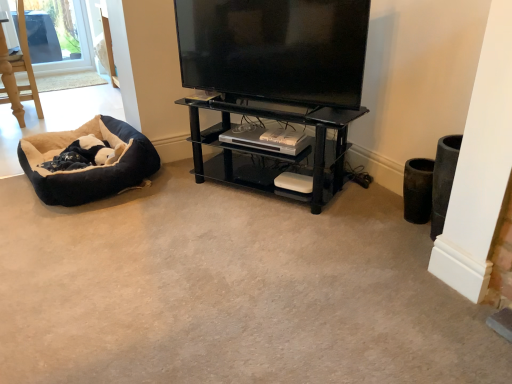
This screenshot has width=512, height=384. What do you see at coordinates (272, 147) in the screenshot?
I see `black glass shelf at center` at bounding box center [272, 147].

Where is `black glossy flat-screen tv at upper center`? Image resolution: width=512 pixels, height=384 pixels. black glossy flat-screen tv at upper center is located at coordinates (275, 48).

From a real-world perspective, which object rests below the other?

black plush dog bed at lower left.

Which point is more forward, (x=104, y=147) or (x=211, y=10)?

Point (x=211, y=10)

Which of these two, black plush dog bed at lower left or black glossy flat-screen tv at upper center, is thinner?

black glossy flat-screen tv at upper center.

From the picture: Considering the relative sizes of soft plush dog bed at left and black glossy flat-screen tv at upper center in the image provided, is soft plush dog bed at left smaller than black glossy flat-screen tv at upper center?

No.

From the image's perspective, is soft plush dog bed at left located above or below black glossy flat-screen tv at upper center?

Based on their image positions, soft plush dog bed at left is located beneath black glossy flat-screen tv at upper center.

Is black glass shelf at center far from soft plush dog bed at left?

They are positioned close to each other.

Is point (226, 114) closer or farther from the camera than point (113, 132)?

Point (226, 114) is closer to the camera than point (113, 132).

How many degrees apart are the facing directions of black glass shelf at center and soft plush dog bed at left?

23.1 degrees separate the facing orientations of black glass shelf at center and soft plush dog bed at left.

Which of these two, black glass shelf at center or soft plush dog bed at left, is smaller?

soft plush dog bed at left is smaller.

Does soft plush dog bed at left appear on the right side of black plush dog bed at lower left?

Indeed, soft plush dog bed at left is positioned on the right side of black plush dog bed at lower left.

Is black plush dog bed at lower left surrounded by soft plush dog bed at left?

Yes, black plush dog bed at lower left is surrounded by soft plush dog bed at left.

From the image's perspective, which one is positioned higher, black glossy flat-screen tv at upper center or black glass shelf at center?

black glossy flat-screen tv at upper center is shown above in the image.

Is point (344, 16) closer or farther from the camera than point (268, 102)?

Point (344, 16).

Is black glossy flat-screen tv at upper center bigger or smaller than black glass shelf at center?

In the image, black glossy flat-screen tv at upper center appears to be smaller than black glass shelf at center.

Can you tell me how much black glossy flat-screen tv at upper center and black glass shelf at center differ in facing direction?

black glossy flat-screen tv at upper center and black glass shelf at center are facing 0.000222 degrees away from each other.

Does black plush dog bed at lower left have a greater height compared to black glass shelf at center?

No, black plush dog bed at lower left is not taller than black glass shelf at center.

Could you tell me if black plush dog bed at lower left is turned towards black glass shelf at center?

No, black plush dog bed at lower left is not aimed at black glass shelf at center.

Which object is further away from the camera taking this photo, black plush dog bed at lower left or black glass shelf at center?

black plush dog bed at lower left is more distant.

How much distance is there between black plush dog bed at lower left and black glass shelf at center?

black plush dog bed at lower left is 30.25 inches away from black glass shelf at center.

Image resolution: width=512 pixels, height=384 pixels. What are the coordinates of `television above the soft plush dog bed at left (from the image's perspective)` in the screenshot? It's located at (275, 48).

Would you say black glossy flat-screen tv at upper center is inside or outside soft plush dog bed at left?

black glossy flat-screen tv at upper center cannot be found inside soft plush dog bed at left.

From a real-world perspective, which is physically below, black glossy flat-screen tv at upper center or soft plush dog bed at left?

soft plush dog bed at left is physically lower.

From the picture: What's the angular difference between black glossy flat-screen tv at upper center and soft plush dog bed at left's facing directions?

black glossy flat-screen tv at upper center and soft plush dog bed at left are facing 23.1 degrees away from each other.

What are the coordinates of `animal on the left of black glossy flat-screen tv at upper center` in the screenshot? It's located at (83, 155).

In order to click on television located in front of the soft plush dog bed at left in this screenshot , I will do [275, 48].

Looking at the image, which one is located further to black glass shelf at center, black glossy flat-screen tv at upper center or soft plush dog bed at left?

soft plush dog bed at left is positioned further to the anchor black glass shelf at center.

Estimate the real-world distances between objects in this image. Which object is further from black glossy flat-screen tv at upper center, soft plush dog bed at left or black plush dog bed at lower left?

The object further to black glossy flat-screen tv at upper center is black plush dog bed at lower left.

Which object lies further to the anchor point black plush dog bed at lower left, black glass shelf at center or black glossy flat-screen tv at upper center?

Based on the image, black glossy flat-screen tv at upper center appears to be further to black plush dog bed at lower left.

Which object lies further to the anchor point soft plush dog bed at left, black plush dog bed at lower left or black glossy flat-screen tv at upper center?

black glossy flat-screen tv at upper center is positioned further to the anchor soft plush dog bed at left.

Based on their spatial positions, is soft plush dog bed at left or black glossy flat-screen tv at upper center closer to black glass shelf at center?

black glossy flat-screen tv at upper center is positioned closer to the anchor black glass shelf at center.

From the image, which object appears to be farther from soft plush dog bed at left, black glass shelf at center or black plush dog bed at lower left?

black glass shelf at center lies further to soft plush dog bed at left than the other object.

Estimate the real-world distances between objects in this image. Which object is further from black glass shelf at center, black plush dog bed at lower left or black glossy flat-screen tv at upper center?

The object further to black glass shelf at center is black plush dog bed at lower left.

Based on their spatial positions, is soft plush dog bed at left or black plush dog bed at lower left further from black glass shelf at center?

Based on the image, black plush dog bed at lower left appears to be further to black glass shelf at center.

Locate an element on the screen. The width and height of the screenshot is (512, 384). dog bed located between black plush dog bed at lower left and black glass shelf at center in the left-right direction is located at coordinates (88, 168).

Find the location of a particular element. dog bed between black plush dog bed at lower left and black glossy flat-screen tv at upper center in the horizontal direction is located at coordinates (88, 168).

The height and width of the screenshot is (384, 512). What are the coordinates of `television between black plush dog bed at lower left and black glass shelf at center` in the screenshot? It's located at (275, 48).

Find the location of a particular element. television between soft plush dog bed at left and black glass shelf at center in the horizontal direction is located at coordinates (275, 48).